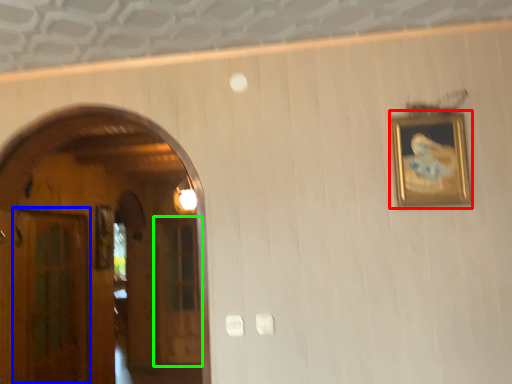
Question: Which object is positioned farthest from picture frame (highlighted by a red box)? Select from glass door (highlighted by a blue box) and glass door (highlighted by a green box).

Choices:
 (A) glass door
 (B) glass door

Answer: (B)